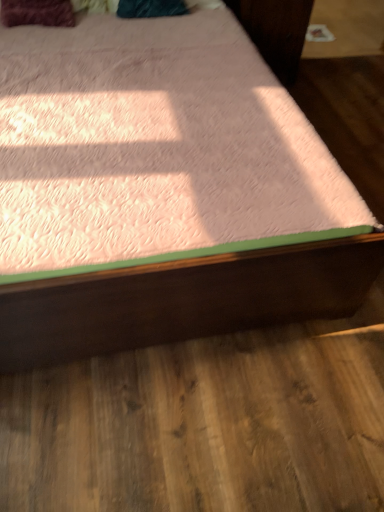
Measure the distance between point (15, 2) and camera.

A distance of 6.53 feet exists between point (15, 2) and camera.

The height and width of the screenshot is (512, 384). Identify the location of velvet maroon pillow at upper left. (37, 13).

Describe the element at coordinates (37, 13) in the screenshot. The height and width of the screenshot is (512, 384). I see `velvet maroon pillow at upper left` at that location.

You are a GUI agent. You are given a task and a screenshot of the screen. Output one action in this format:
    pyautogui.click(x=<x>, y=<y>)
    Task: Click on the pink plush bed at center
    
    Given the screenshot: What is the action you would take?
    pyautogui.click(x=155, y=145)

Describe the element at coordinates (155, 145) in the screenshot. This screenshot has height=512, width=384. I see `pink plush bed at center` at that location.

This screenshot has width=384, height=512. I want to click on velvet maroon pillow at upper left, so click(37, 13).

Which is more to the right, pink plush bed at center or velvet maroon pillow at upper left?

Positioned to the right is pink plush bed at center.

Between pink plush bed at center and velvet maroon pillow at upper left, which one is positioned in front?

pink plush bed at center is closer to the camera.

Considering the positions of point (15, 239) and point (65, 12), is point (15, 239) closer or farther from the camera than point (65, 12)?

Point (15, 239) appears to be closer to the viewer than point (65, 12).

From the image's perspective, is pink plush bed at center above or below velvet maroon pillow at upper left?

From the image's perspective, pink plush bed at center appears below velvet maroon pillow at upper left.

From a real-world perspective, is pink plush bed at center located higher than velvet maroon pillow at upper left?

No, from a real-world perspective, pink plush bed at center is not over velvet maroon pillow at upper left

Considering the relative sizes of pink plush bed at center and velvet maroon pillow at upper left in the image provided, is pink plush bed at center wider than velvet maroon pillow at upper left?

Indeed, pink plush bed at center has a greater width compared to velvet maroon pillow at upper left.

Does pink plush bed at center have a greater height compared to velvet maroon pillow at upper left?

Yes, pink plush bed at center is taller than velvet maroon pillow at upper left.

Which of these two, pink plush bed at center or velvet maroon pillow at upper left, is smaller?

Smaller between the two is velvet maroon pillow at upper left.

Which is correct: pink plush bed at center is inside velvet maroon pillow at upper left, or outside of it?

pink plush bed at center is spatially situated outside velvet maroon pillow at upper left.

Is pink plush bed at center next to velvet maroon pillow at upper left?

No, pink plush bed at center is not beside velvet maroon pillow at upper left.

Is pink plush bed at center oriented away from velvet maroon pillow at upper left?

Absolutely, pink plush bed at center is directed away from velvet maroon pillow at upper left.

How different are the orientations of pink plush bed at center and velvet maroon pillow at upper left in degrees?

1.82 degrees.

Measure the distance from pink plush bed at center to velvet maroon pillow at upper left.

pink plush bed at center is 89.36 centimeters away from velvet maroon pillow at upper left.

Identify the location of pillow behind the pink plush bed at center. The width and height of the screenshot is (384, 512). (37, 13).

Does velvet maroon pillow at upper left appear on the left side of pink plush bed at center?

Indeed, velvet maroon pillow at upper left is positioned on the left side of pink plush bed at center.

Is the depth of velvet maroon pillow at upper left greater than that of pink plush bed at center?

Yes, velvet maroon pillow at upper left is behind pink plush bed at center.

Does point (16, 25) appear closer or farther from the camera than point (126, 224)?

Point (16, 25) appears to be farther away from the viewer than point (126, 224).

From the image's perspective, which object appears higher, velvet maroon pillow at upper left or pink plush bed at center?

velvet maroon pillow at upper left.

From a real-world perspective, who is located higher, velvet maroon pillow at upper left or pink plush bed at center?

velvet maroon pillow at upper left is physically above.

Which of these two, velvet maroon pillow at upper left or pink plush bed at center, is wider?

pink plush bed at center is wider.

Which of these two, velvet maroon pillow at upper left or pink plush bed at center, stands shorter?

Standing shorter between the two is velvet maroon pillow at upper left.

Who is smaller, velvet maroon pillow at upper left or pink plush bed at center?

Smaller between the two is velvet maroon pillow at upper left.

Is velvet maroon pillow at upper left inside or outside of pink plush bed at center?

velvet maroon pillow at upper left exists entirely within pink plush bed at center.

Are velvet maroon pillow at upper left and pink plush bed at center located far from each other?

Actually, velvet maroon pillow at upper left and pink plush bed at center are a little close together.

Does velvet maroon pillow at upper left turn towards pink plush bed at center?

Yes.

How many degrees apart are the facing directions of velvet maroon pillow at upper left and pink plush bed at center?

1.82 degrees separate the facing orientations of velvet maroon pillow at upper left and pink plush bed at center.

The height and width of the screenshot is (512, 384). In order to click on pillow above the pink plush bed at center (from a real-world perspective) in this screenshot , I will do `click(37, 13)`.

Locate an element on the screen. Image resolution: width=384 pixels, height=512 pixels. pillow located on the left of pink plush bed at center is located at coordinates (37, 13).

The image size is (384, 512). I want to click on bed in front of the velvet maroon pillow at upper left, so click(155, 145).